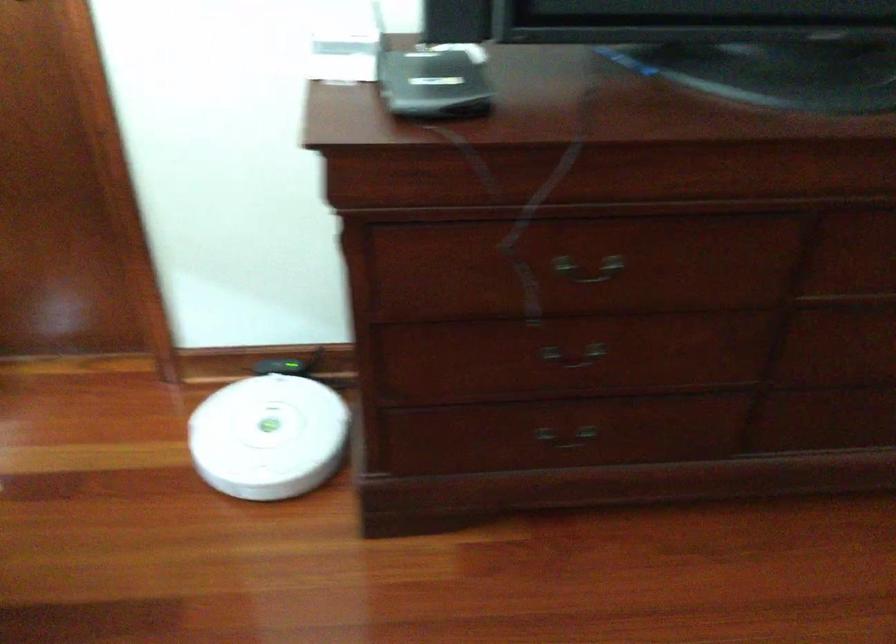
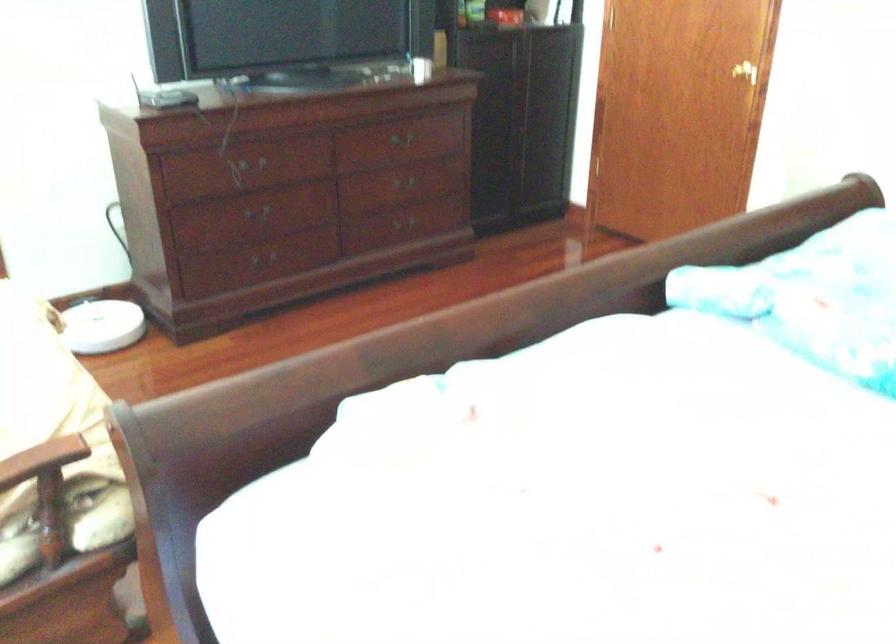
In the second image, find the point that corresponds to (609,258) in the first image.

(255, 164)